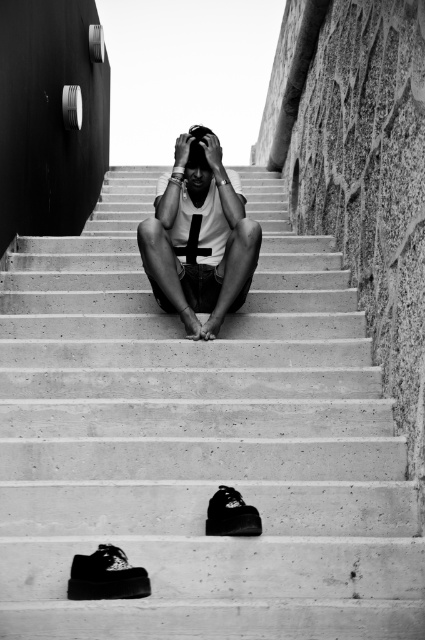
Does white matte shirt at center appear on the right side of black leather shoe at lower center?

Indeed, white matte shirt at center is positioned on the right side of black leather shoe at lower center.

From the picture: How much distance is there between white matte shirt at center and black leather shoe at lower center?

The distance of white matte shirt at center from black leather shoe at lower center is 2.20 meters.

Where is `white matte shirt at center`? The width and height of the screenshot is (425, 640). white matte shirt at center is located at coordinates (198, 237).

The image size is (425, 640). In order to click on white matte shirt at center in this screenshot , I will do `click(198, 237)`.

Does white matte shirt at center appear on the right side of smooth skin head at center?

Incorrect, white matte shirt at center is not on the right side of smooth skin head at center.

Does white matte shirt at center have a smaller size compared to smooth skin head at center?

Incorrect, white matte shirt at center is not smaller in size than smooth skin head at center.

Is point (169, 225) positioned in front of point (187, 177)?

That is True.

Where is `white matte shirt at center`? white matte shirt at center is located at coordinates (198, 237).

Can you confirm if white matte shirt at center is shorter than black leather shoe at center?

No.

At what (x,y) coordinates should I click in order to perform the action: click on white matte shirt at center. Please return your answer as a coordinate pair (x, y). Looking at the image, I should click on (198, 237).